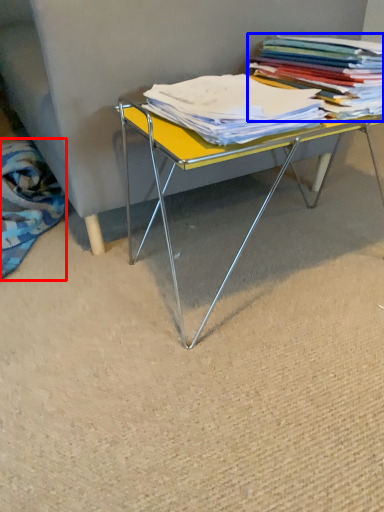
Question: Among these objects, which one is farthest to the camera, fabric (highlighted by a red box) or book (highlighted by a blue box)?

Choices:
 (A) fabric
 (B) book

Answer: (A)